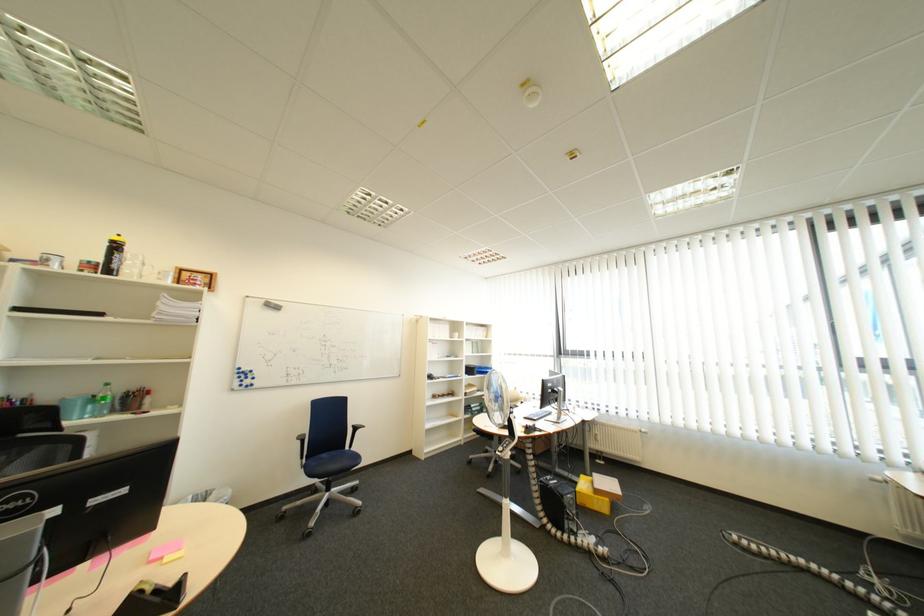
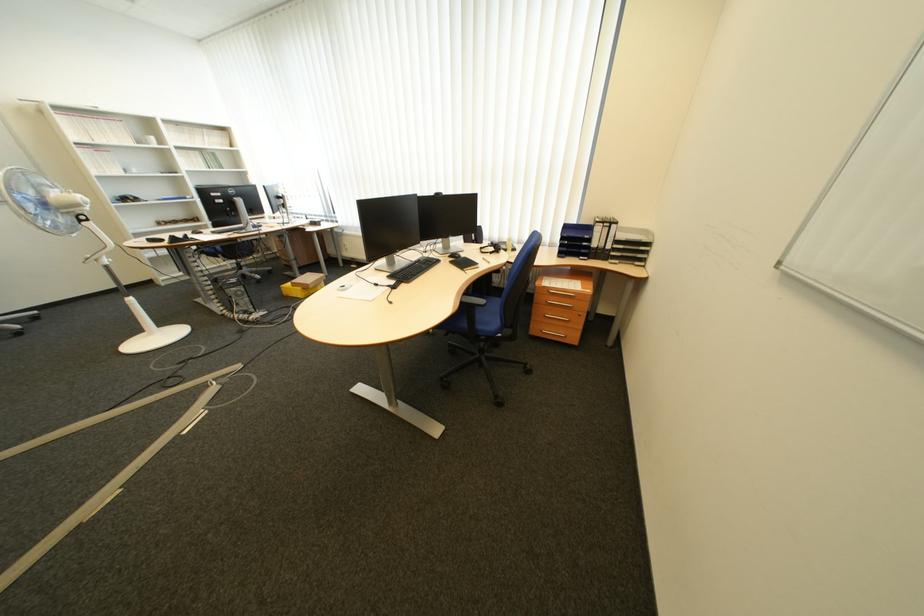
Where in the second image is the point corresponding to (621,501) from the first image?

(313, 290)